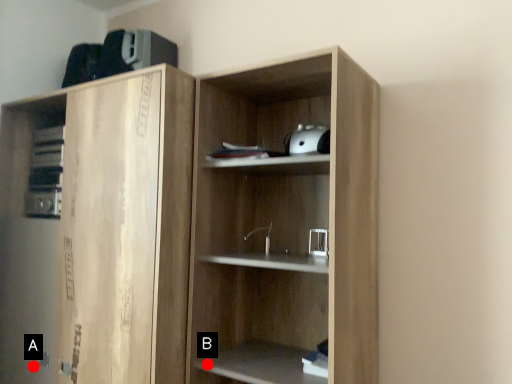
Question: Two points are circled on the image, labeled by A and B beside each circle. Among these points, which one is farthest from the camera?

Choices:
 (A) A is further
 (B) B is further

Answer: (A)